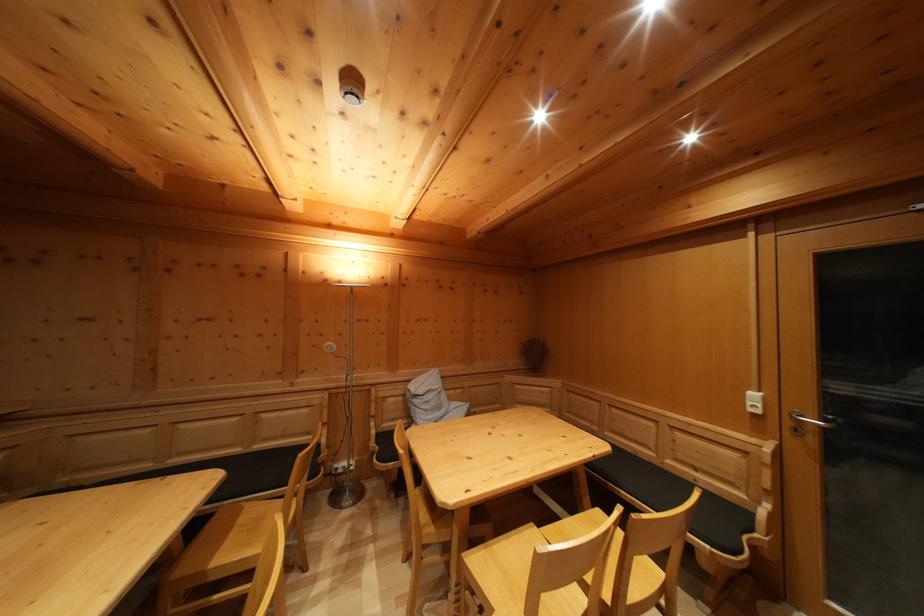
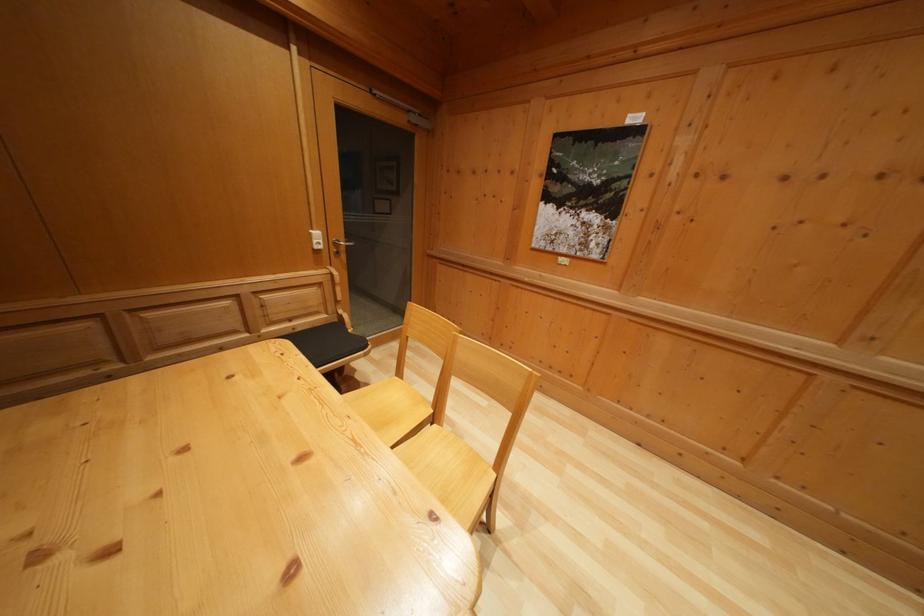
In the second image, find the point that corresponds to point (760, 402) in the first image.

(322, 240)